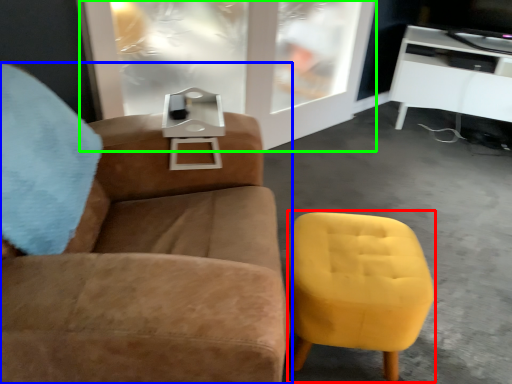
Question: Considering the real-world distances, which object is closest to swivel chair (highlighted by a red box)? chair (highlighted by a blue box) or glass door (highlighted by a green box).

Choices:
 (A) chair
 (B) glass door

Answer: (A)